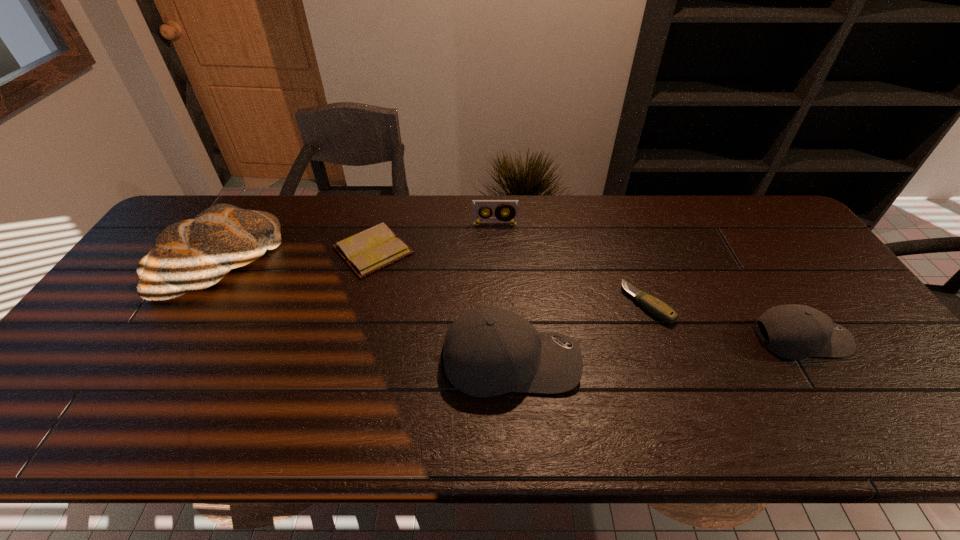
Where is `object present at the right edge`? The height and width of the screenshot is (540, 960). object present at the right edge is located at coordinates (795, 332).

Where is `object present at the far left corner`? The image size is (960, 540). object present at the far left corner is located at coordinates (194, 254).

Locate an element on the screen. Image resolution: width=960 pixels, height=540 pixels. vacant region at the far edge of the desktop is located at coordinates (696, 234).

In the image, there is a desktop. At what (x,y) coordinates should I click in order to perform the action: click on vacant space at the near edge. Please return your answer as a coordinate pair (x, y). Image resolution: width=960 pixels, height=540 pixels. Looking at the image, I should click on (522, 397).

Image resolution: width=960 pixels, height=540 pixels. Find the location of `free space at the left edge of the desktop`. free space at the left edge of the desktop is located at coordinates (131, 340).

You are a GUI agent. You are given a task and a screenshot of the screen. Output one action in this format:
    pyautogui.click(x=<x>, y=<y>)
    Task: Click on the blank space at the right edge
    
    Given the screenshot: What is the action you would take?
    click(x=856, y=328)

The height and width of the screenshot is (540, 960). In the image, there is a desktop. What are the coordinates of `vacant space at the far left corner` in the screenshot? It's located at (237, 196).

I want to click on vacant space at the far right corner of the desktop, so click(x=743, y=230).

The height and width of the screenshot is (540, 960). I want to click on vacant point located between the leftmost object and the taller baseball cap, so click(x=365, y=312).

Find the location of a particular element. This screenshot has height=540, width=960. empty location between the videotape and the rightmost object is located at coordinates (647, 281).